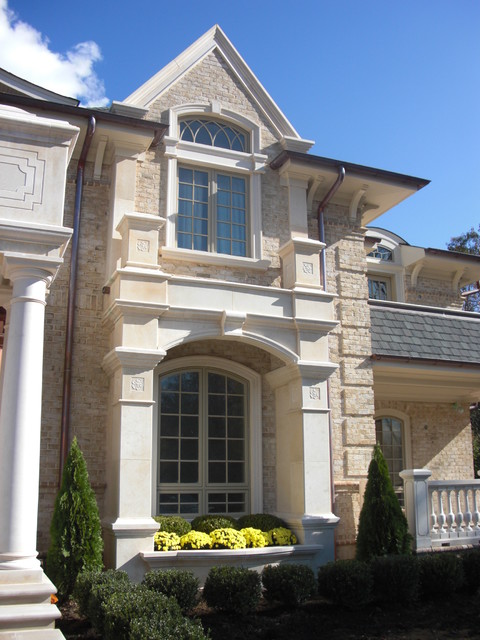
You are a GUI agent. You are given a task and a screenshot of the screen. Output one action in this format:
    pyautogui.click(x=<x>, y=<y>)
    Task: Click on the window
    The image size is (480, 640).
    Given the screenshot: What is the action you would take?
    pyautogui.click(x=220, y=440)